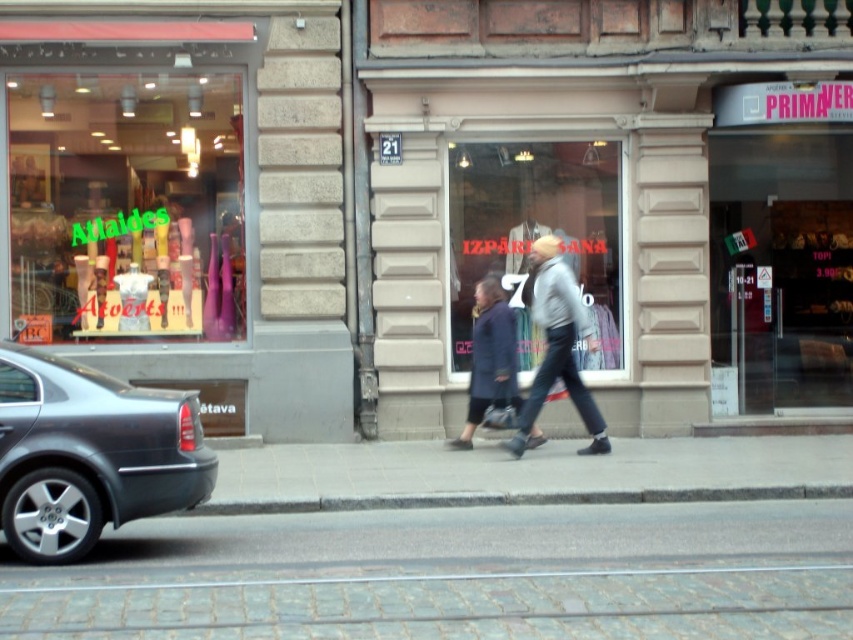
Between transparent glass display at center and gray knit sweater at center, which one has more height?

Standing taller between the two is transparent glass display at center.

Is transparent glass display at center positioned at the back of gray knit sweater at center?

Yes, transparent glass display at center is further from the viewer.

This screenshot has height=640, width=853. What are the coordinates of `transparent glass display at center` in the screenshot? It's located at (535, 234).

Find the location of a particular element. This screenshot has width=853, height=640. transparent glass display at center is located at coordinates (535, 234).

Find the location of `matte glass window at center`. matte glass window at center is located at coordinates coord(605,182).

How far apart are matte glass window at center and cobblestone pavement at lower center?

7.81 meters

Which is behind, point (683, 285) or point (321, 618)?

The point (683, 285) is behind.

You are a GUI agent. You are given a task and a screenshot of the screen. Output one action in this format:
    pyautogui.click(x=<x>, y=<y>)
    Task: Click on the matte glass window at center
    The image size is (853, 640).
    Given the screenshot: What is the action you would take?
    pyautogui.click(x=605, y=182)

Based on the photo, can you confirm if translucent glass vase at left is positioned below dark blue coat at center?

No, translucent glass vase at left is not below dark blue coat at center.

Measure the distance between translucent glass vase at left and camera.

translucent glass vase at left is 11.69 meters from camera.

Does point (128, 285) come behind point (490, 324)?

Yes, it is.

Identify the location of translucent glass vase at left. (125, 205).